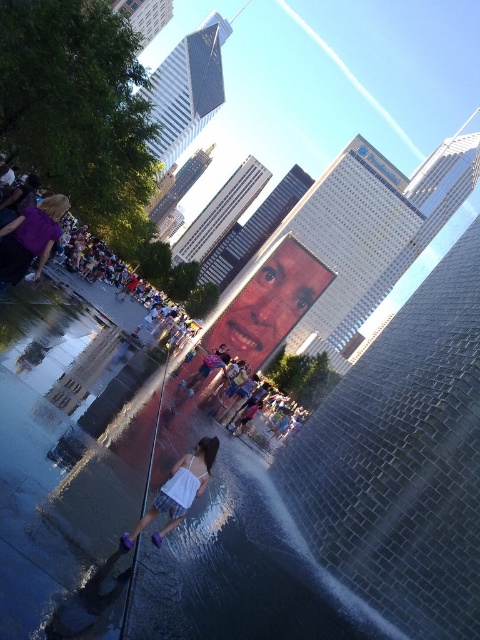
Can you confirm if matte purple dress at left is smaller than white fabric dress at lower center?

Yes, matte purple dress at left is smaller than white fabric dress at lower center.

Image resolution: width=480 pixels, height=640 pixels. Describe the element at coordinates (29, 237) in the screenshot. I see `matte purple dress at left` at that location.

The height and width of the screenshot is (640, 480). Find the location of `matte purple dress at left`. matte purple dress at left is located at coordinates (29, 237).